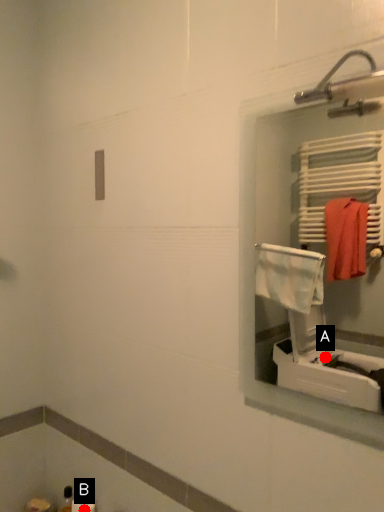
Question: Two points are circled on the image, labeled by A and B beside each circle. Which point appears farthest from the camera in this image?

Choices:
 (A) A is further
 (B) B is further

Answer: (A)